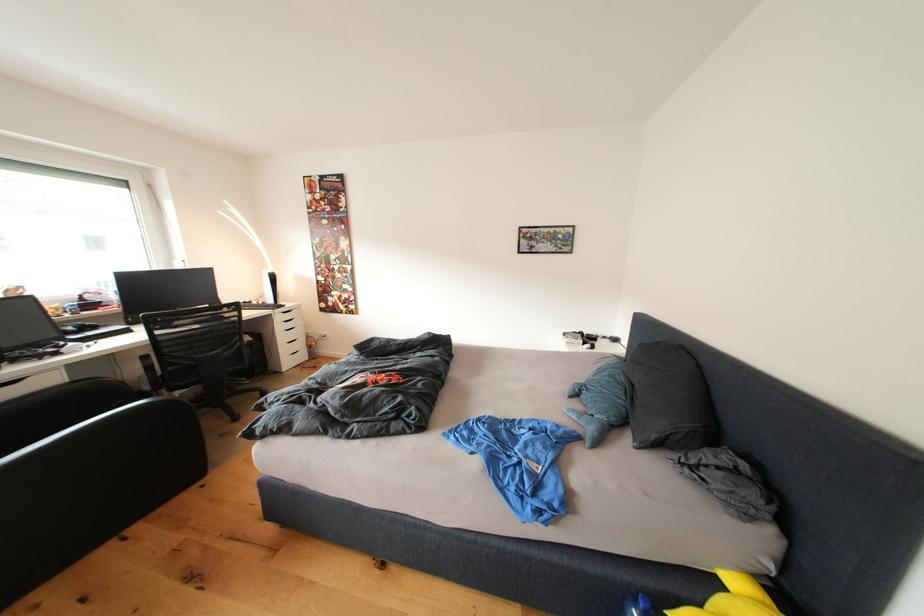
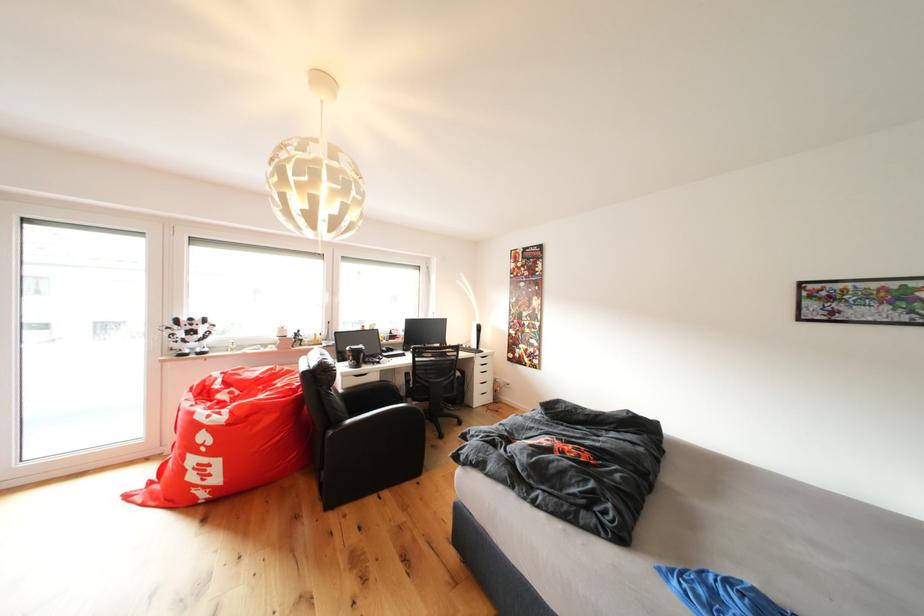
Locate, in the second image, the point that corresponds to pixel 290 308 in the first image.

(490, 354)